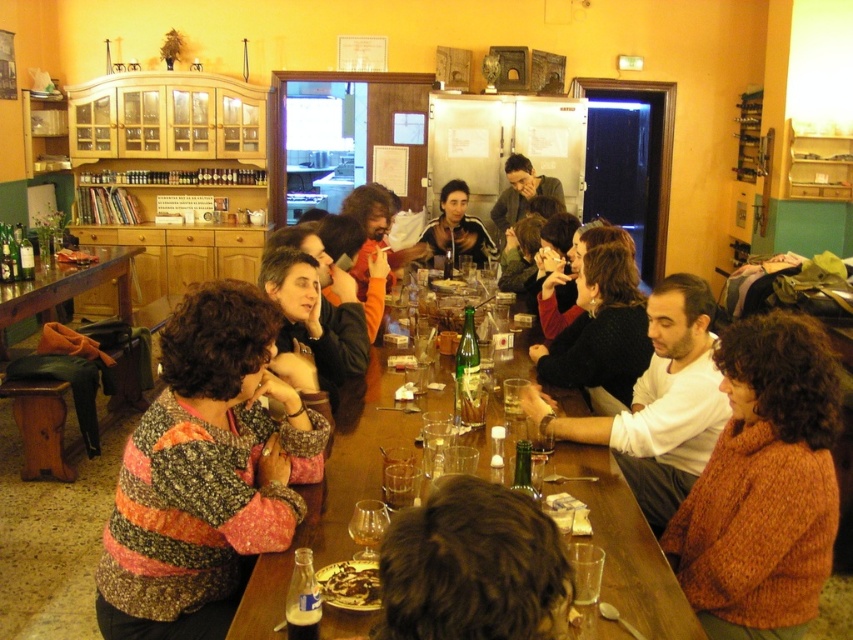
You are a waiter in this bar and need to place a new dessert order on the table. The dessert is the size of the chocolate cake at center. However, there is a dark gray fabric jacket at center on the table. Can you fit the dessert on the table without moving any other items?

The dark gray fabric jacket at center is larger in size than the chocolate cake at center. Since the jacket is bigger, there might still be enough space left on the table to place the dessert without moving other items, provided the remaining space is sufficient. However, this depends on the arrangement of other items on the table.

You are a photographer trying to capture a candid shot of the group at the table. You notice the brown curly hair at center and the matte black sweater at center. Which of these two items takes up more visual space in the photo?

The matte black sweater at center takes up more visual space than the brown curly hair at center.

You are standing at the point labeled point at (428, 241) and want to reach the exit door located at the opposite side of the room. The room is 20 feet long. Can you safely walk from your current position to the exit without needing to detour around any obstacles?

The distance between you and the exit door is 17.50 feet, which is less than the room length of 20 feet. Therefore, you can safely walk straight to the exit without needing to detour around obstacles.